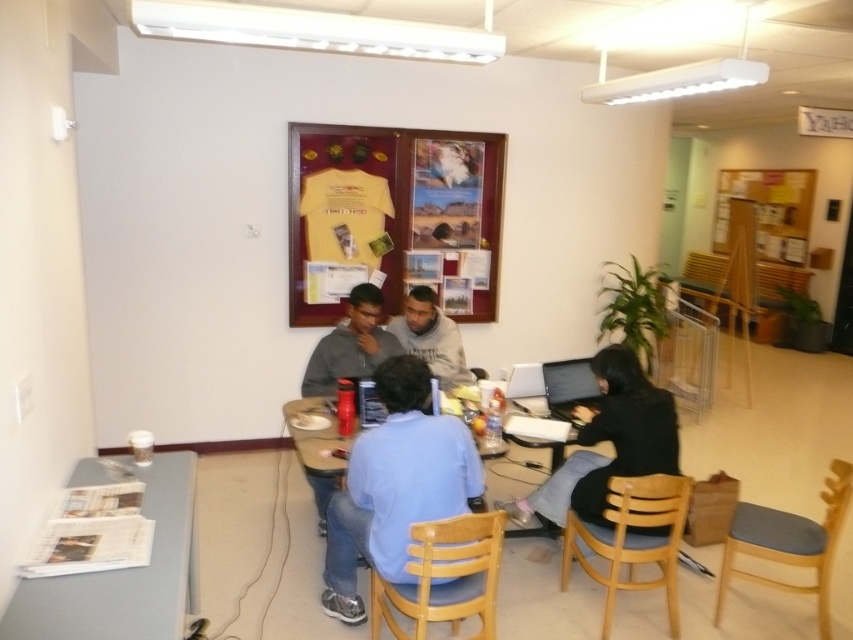
Question: Which of the following is the farthest from the observer?

Choices:
 (A) (196, 570)
 (B) (364, 368)
 (C) (622, 408)

Answer: (B)

Question: From the image, what is the correct spatial relationship of black matte laptop at lower right in relation to gray fleece sweatshirt at center?

Choices:
 (A) right
 (B) left

Answer: (A)

Question: Which point is farther from the camera taking this photo?

Choices:
 (A) (532, 532)
 (B) (419, 516)

Answer: (A)

Question: Which object is farther from the camera taking this photo?

Choices:
 (A) wooden table at center
 (B) yellow fabric bulletin board at upper center

Answer: (B)

Question: Does yellow fabric bulletin board at upper center have a lesser width compared to black matte laptop at lower right?

Choices:
 (A) no
 (B) yes

Answer: (A)

Question: Does white glossy table at lower left have a lesser width compared to gray fleece sweatshirt at center?

Choices:
 (A) no
 (B) yes

Answer: (A)